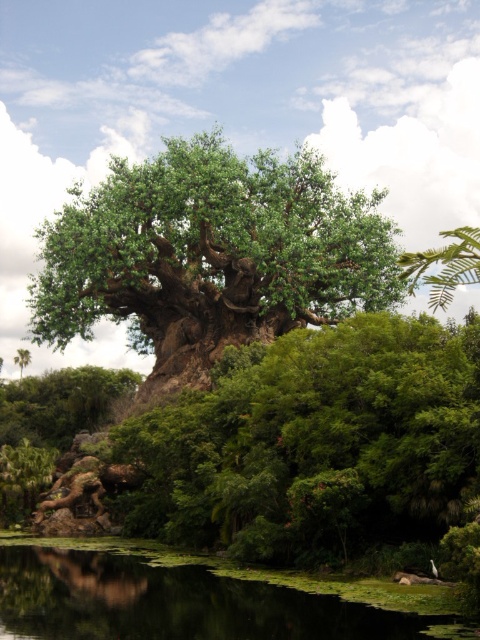
You are standing at the base of the Tree of Life and want to walk towards the point labeled point (192, 173). However, there is an obstacle at point labeled point (24, 364). Will you encounter the obstacle before reaching your destination?

Since point (192, 173) is in front of point (24, 364), you will reach your destination before encountering the obstacle at point (24, 364).

You are standing in front of the Tree of Life. You see the green rough bark tree at center and the green algae water at lower center. Which object is higher in the scene?

The green rough bark tree at center is above the green algae water at lower center, so it is higher in the scene.

You are a visitor at Disney Animal Kingdom and want to take a photo of the iconic Tree of Life. You notice the green algae water at lower center and the green leafy tree at center. Which object is located below the other?

The green algae water at lower center is positioned under the green leafy tree at center, so the green algae water at lower center is below the green leafy tree at center.